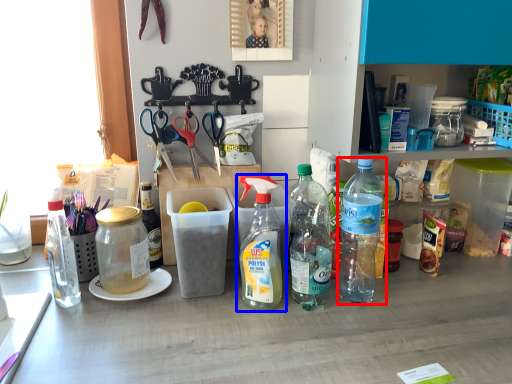
Question: Among these objects, which one is farthest to the camera, bottle (highlighted by a red box) or bottle (highlighted by a blue box)?

Choices:
 (A) bottle
 (B) bottle

Answer: (A)